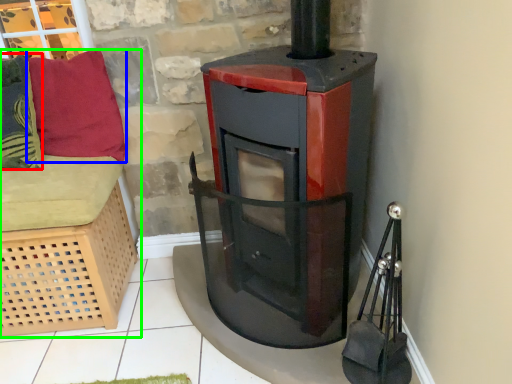
Question: Estimate the real-world distances between objects in this image. Which object is closer to pillow (highlighted by a red box), pillow (highlighted by a blue box) or furniture (highlighted by a green box)?

Choices:
 (A) pillow
 (B) furniture

Answer: (A)